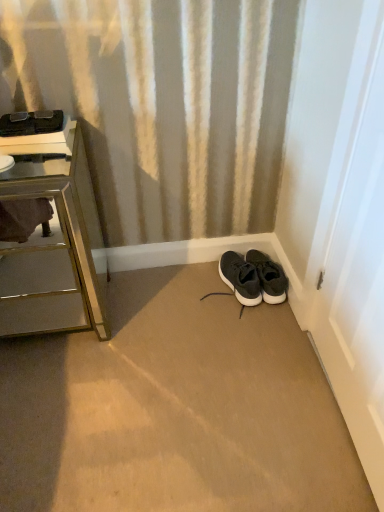
Where is `vacant area that is in front of black matte sneakers at lower right`? The height and width of the screenshot is (512, 384). vacant area that is in front of black matte sneakers at lower right is located at coordinates point(268,322).